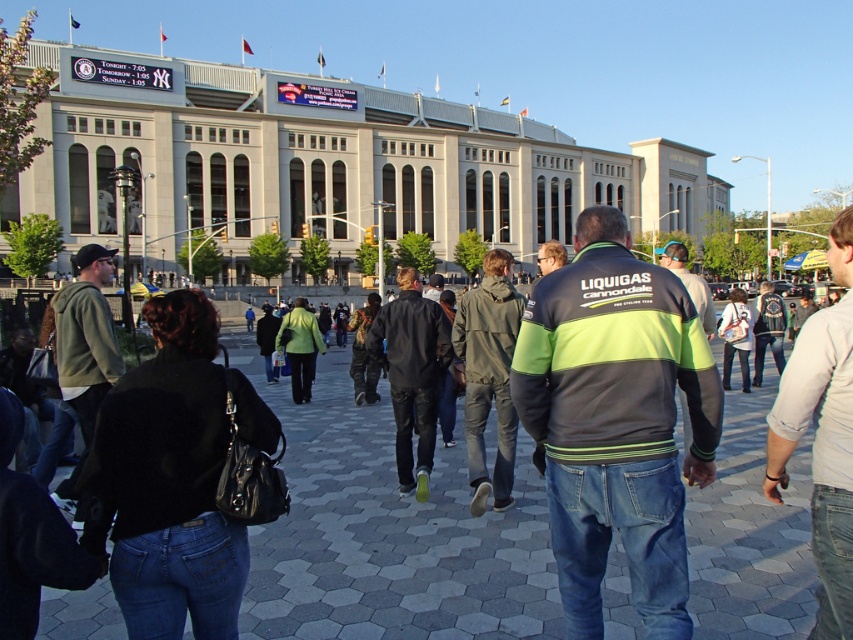
In the scene shown: You are a photographer standing at the edge of the paved area outside the stadium. You want to take a photo of both the dark green jacket at center and the black leather jacket at center. Which jacket should you focus on first to ensure both are in sharp focus?

You should focus on the dark green jacket at center first because it is closer to the viewer than the black leather jacket at center. By focusing on the closer jacket, the farther one will also be in focus due to the depth of field.

You are a photographer standing at the center of the paved area in front of the stadium. You want to capture a photo of the black leather jacket at center without including the LIQUIGAS cannondale jacket in the background. Is the jacket at point (410, 372) positioned in a way that allows this?

The black leather jacket at center is located at point (410, 372). Since the LIQUIGAS cannondale jacket is not mentioned in relation to this point, it is possible to frame the photo to exclude it.